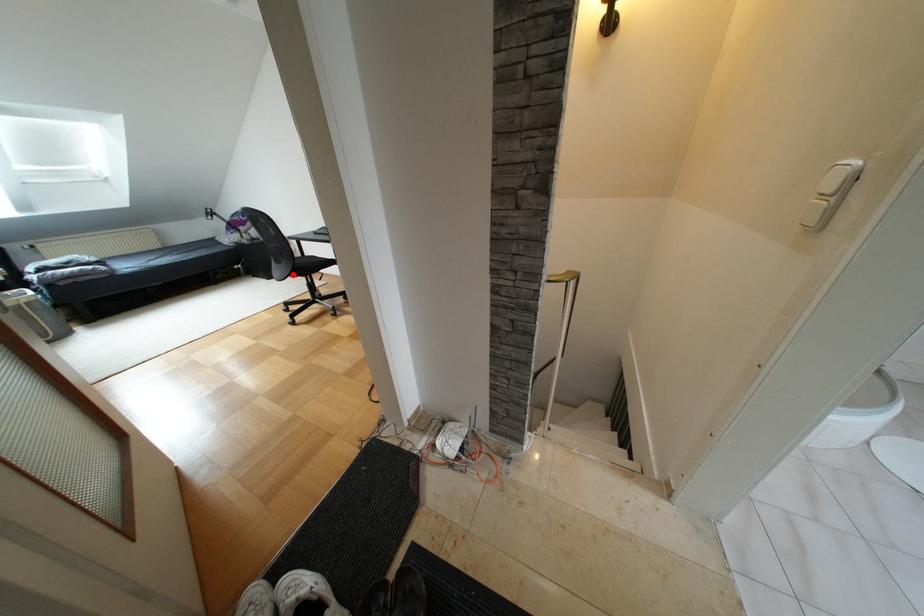
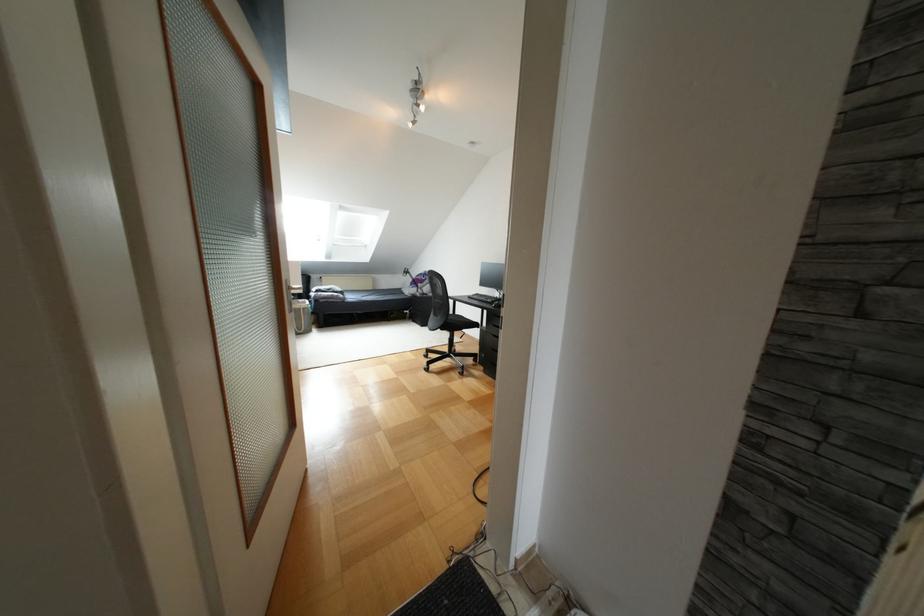
Question: I am providing you with two images of the same scene from different viewpoints. Given a red point in image1, look at the same physical point in image2. Is it:

Choices:
 (A) Closer to the viewpoint
 (B) Farther from the viewpoint

Answer: (B)